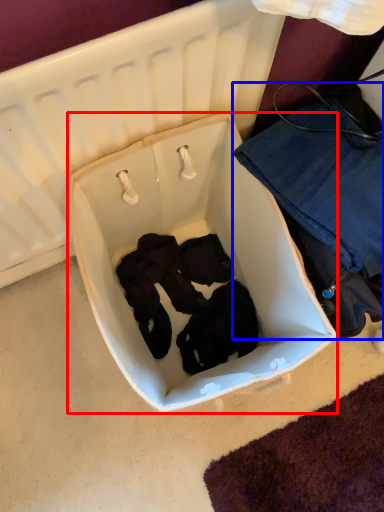
Question: Among these objects, which one is nearest to the camera, infant bed (highlighted by a red box) or clothing (highlighted by a blue box)?

Choices:
 (A) infant bed
 (B) clothing

Answer: (A)